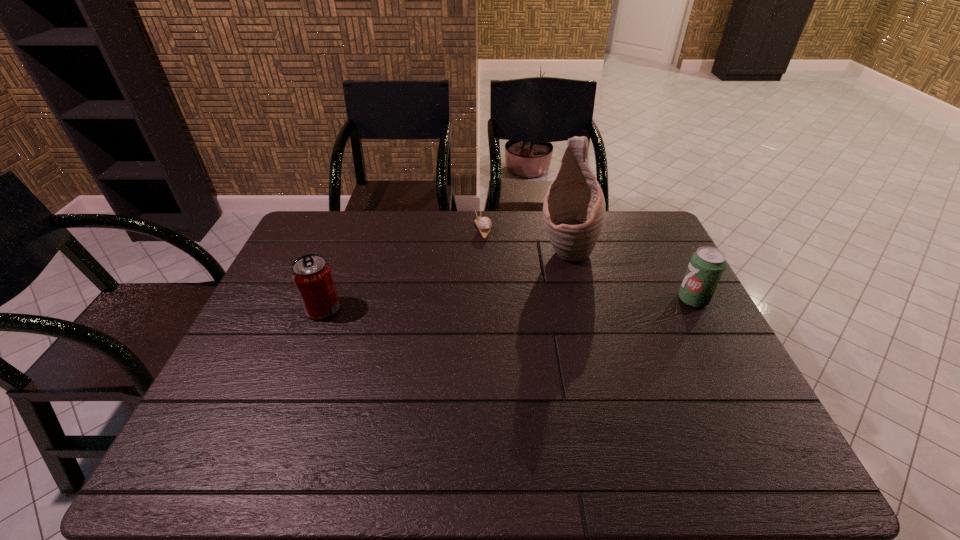
Where is `the left soda`? the left soda is located at coordinates (312, 275).

Identify the location of the rightmost object. The image size is (960, 540). (706, 266).

Where is `pitcher`? pitcher is located at coordinates (574, 210).

Find the location of `the third object from left to right`. the third object from left to right is located at coordinates (574, 210).

Locate an element on the screen. This screenshot has width=960, height=540. the third object from right to left is located at coordinates (484, 224).

Identify the location of escargot. (484, 224).

The image size is (960, 540). I want to click on vacant space located 0.050m on the left of the left soda, so click(288, 309).

You are a GUI agent. You are given a task and a screenshot of the screen. Output one action in this format:
    pyautogui.click(x=<x>, y=<y>)
    Task: Click on the free space located 0.300m on the left of the rightmost object
    
    Given the screenshot: What is the action you would take?
    pyautogui.click(x=574, y=299)

Where is `blank space located at the spout of the pitcher`? blank space located at the spout of the pitcher is located at coordinates (558, 327).

The image size is (960, 540). What are the coordinates of `vacant space located at the spout of the pitcher` in the screenshot? It's located at (556, 343).